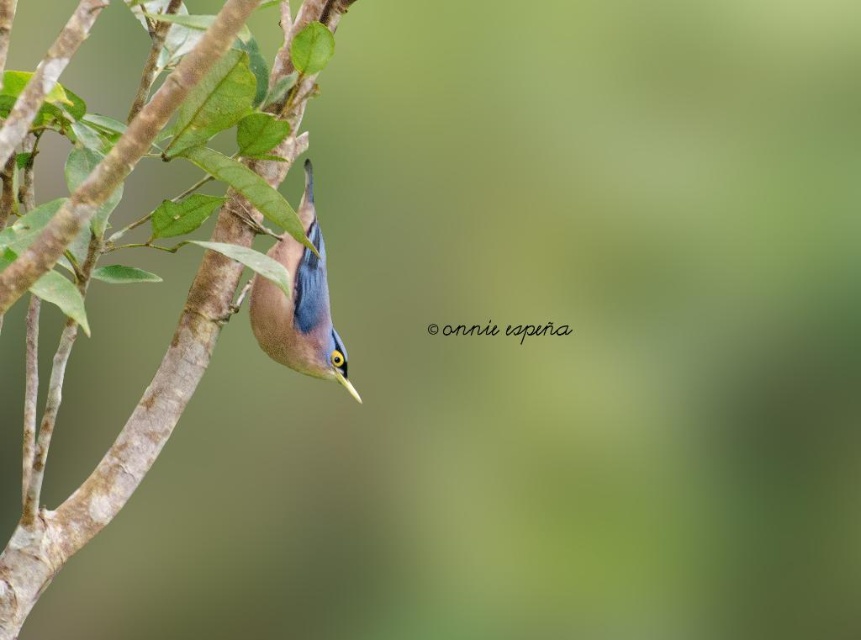
You are an ornithologist observing a bird in a forest. You notice a point marked at coordinates (x=119, y=451). Which object in the scene is located at this point?

The point at (x=119, y=451) marks the location of the smooth bark branch at center left.

You are observing the bird and the branch in the image. Which of the two points, point (245,234) or point (358,401), is closer to you?

Point (245,234) is closer to you because it is further to the camera than point (358,401).